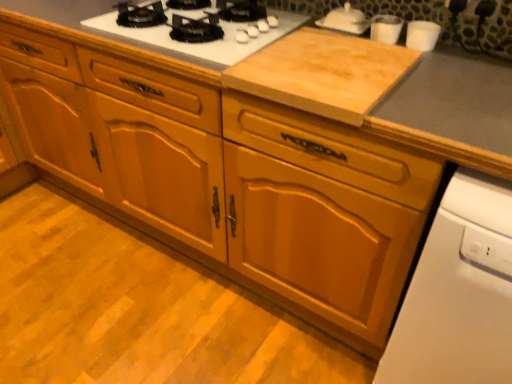
Question: Could you tell me if natural wood cutting board at center is facing white glossy gas stove at upper center?

Choices:
 (A) no
 (B) yes

Answer: (A)

Question: Is natural wood cutting board at center taller than white glossy gas stove at upper center?

Choices:
 (A) no
 (B) yes

Answer: (A)

Question: From a real-world perspective, is natural wood cutting board at center positioned under white glossy gas stove at upper center based on gravity?

Choices:
 (A) yes
 (B) no

Answer: (A)

Question: Is natural wood cutting board at center looking in the opposite direction of white glossy gas stove at upper center?

Choices:
 (A) no
 (B) yes

Answer: (A)

Question: From the image's perspective, is natural wood cutting board at center located above white glossy gas stove at upper center?

Choices:
 (A) yes
 (B) no

Answer: (B)

Question: Looking at their shapes, would you say white glossy cups at upper right, the first appliance in the right-to-left sequence, is wider or thinner than clear glass cups at upper right, arranged as the 2th appliance when viewed from the left?

Choices:
 (A) wide
 (B) thin

Answer: (A)

Question: Is white glossy cups at upper right, marked as the third appliance in a left-to-right arrangement, in front of or behind clear glass cups at upper right, arranged as the 2th appliance when viewed from the left, in the image?

Choices:
 (A) front
 (B) behind

Answer: (A)

Question: From their relative heights in the image, would you say white glossy cups at upper right, the first appliance in the right-to-left sequence, is taller or shorter than clear glass cups at upper right, the 2th appliance viewed from the right?

Choices:
 (A) tall
 (B) short

Answer: (A)

Question: From a real-world perspective, is white glossy cups at upper right, marked as the third appliance in a left-to-right arrangement, above or below clear glass cups at upper right, arranged as the 2th appliance when viewed from the left?

Choices:
 (A) above
 (B) below

Answer: (A)

Question: In the image, is clear glass cups at upper right, arranged as the 2th appliance when viewed from the left, on the left side or the right side of white glossy cups at upper right, marked as the third appliance in a left-to-right arrangement?

Choices:
 (A) right
 (B) left

Answer: (B)

Question: Considering the positions of clear glass cups at upper right, arranged as the 2th appliance when viewed from the left, and white glossy cups at upper right, marked as the third appliance in a left-to-right arrangement, in the image, is clear glass cups at upper right, arranged as the 2th appliance when viewed from the left, wider or thinner than white glossy cups at upper right, marked as the third appliance in a left-to-right arrangement,?

Choices:
 (A) wide
 (B) thin

Answer: (B)

Question: From a real-world perspective, is clear glass cups at upper right, arranged as the 2th appliance when viewed from the left, physically located above or below white glossy cups at upper right, marked as the third appliance in a left-to-right arrangement?

Choices:
 (A) above
 (B) below

Answer: (B)

Question: Considering the positions of clear glass cups at upper right, arranged as the 2th appliance when viewed from the left, and white glossy cups at upper right, marked as the third appliance in a left-to-right arrangement, in the image, is clear glass cups at upper right, arranged as the 2th appliance when viewed from the left, bigger or smaller than white glossy cups at upper right, marked as the third appliance in a left-to-right arrangement,?

Choices:
 (A) big
 (B) small

Answer: (A)

Question: From a real-world perspective, is white glossy cups at upper right, the first appliance in the right-to-left sequence, above or below white glossy dishwasher at lower right?

Choices:
 (A) above
 (B) below

Answer: (A)

Question: Is white glossy cups at upper right, marked as the third appliance in a left-to-right arrangement, spatially inside white glossy dishwasher at lower right, or outside of it?

Choices:
 (A) inside
 (B) outside

Answer: (B)